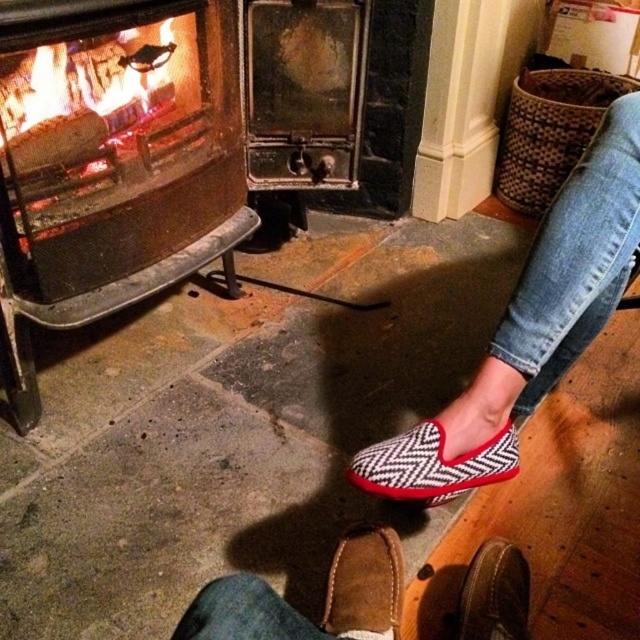
Does brown suede shoes at lower center have a lesser height compared to herringbone fabric slipper at lower center?

Indeed, brown suede shoes at lower center has a lesser height compared to herringbone fabric slipper at lower center.

Who is higher up, brown suede shoes at lower center or herringbone fabric slipper at lower center?

Positioned higher is herringbone fabric slipper at lower center.

Between point (214, 598) and point (428, 449), which one is positioned behind?

Point (428, 449)

Locate an element on the screen. The height and width of the screenshot is (640, 640). brown suede shoes at lower center is located at coordinates (324, 600).

Is black and white zigzag slipper at lower center taller than brown suede shoes at lower center?

Indeed, black and white zigzag slipper at lower center has a greater height compared to brown suede shoes at lower center.

Which of these two, black and white zigzag slipper at lower center or brown suede shoes at lower center, stands shorter?

brown suede shoes at lower center is shorter.

Does point (355, 467) lie in front of point (216, 609)?

That is False.

I want to click on black and white zigzag slipper at lower center, so click(x=529, y=326).

Which is in front, point (445, 500) or point (360, 573)?

Positioned in front is point (360, 573).

Does black and white zigzag slipper at lower center appear under brown suede shoe at lower center?

No.

Is point (588, 328) farther from camera compared to point (365, 602)?

Yes.

Where is `black and white zigzag slipper at lower center`? Image resolution: width=640 pixels, height=640 pixels. black and white zigzag slipper at lower center is located at coordinates (529, 326).